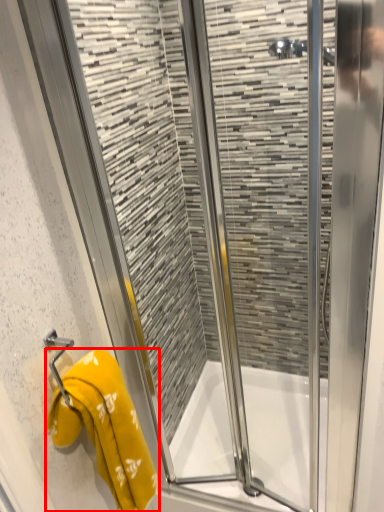
Question: From the image's perspective, what is the correct spatial positioning of towel (annotated by the red box) in reference to bath?

Choices:
 (A) above
 (B) below

Answer: (A)